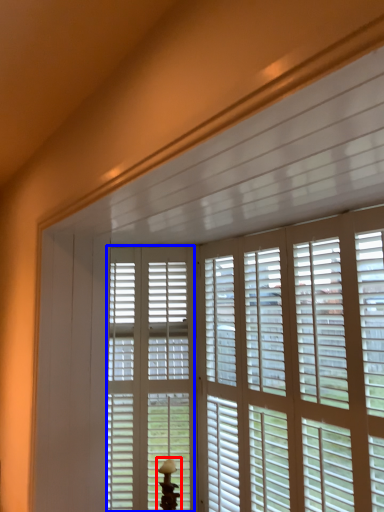
Question: Which of the following is the farthest to the observer, table lamp (highlighted by a red box) or screen door (highlighted by a blue box)?

Choices:
 (A) table lamp
 (B) screen door

Answer: (B)